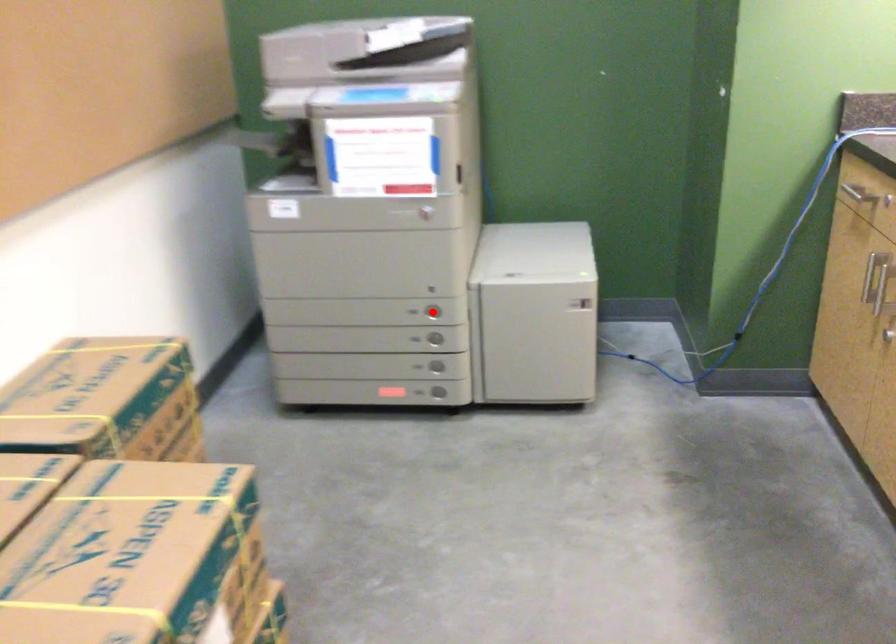
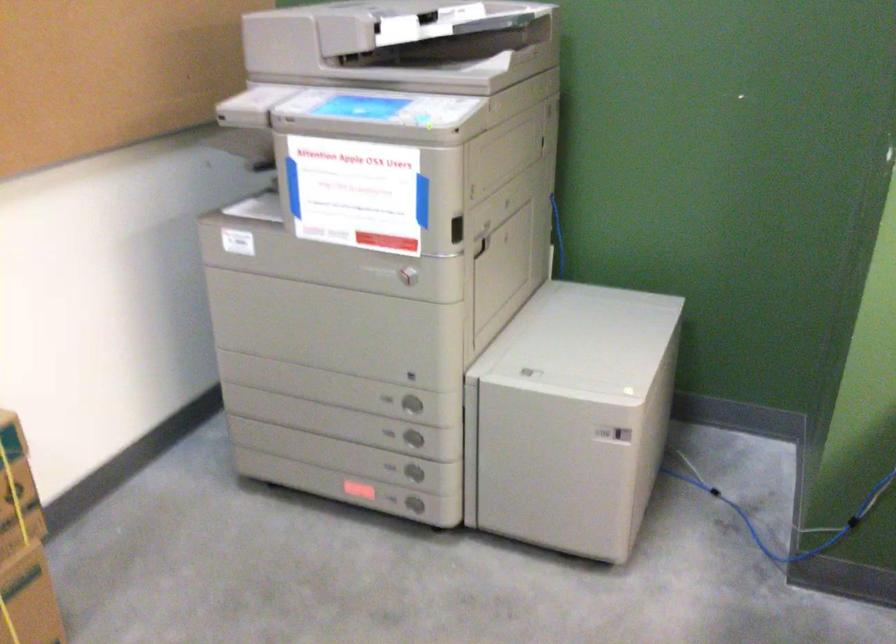
Question: I am providing you with two images of the same scene from different viewpoints. A red point is shown in image1. For the corresponding object point in image2, is it positioned nearer or farther from the camera?

Choices:
 (A) Nearer
 (B) Farther

Answer: (A)